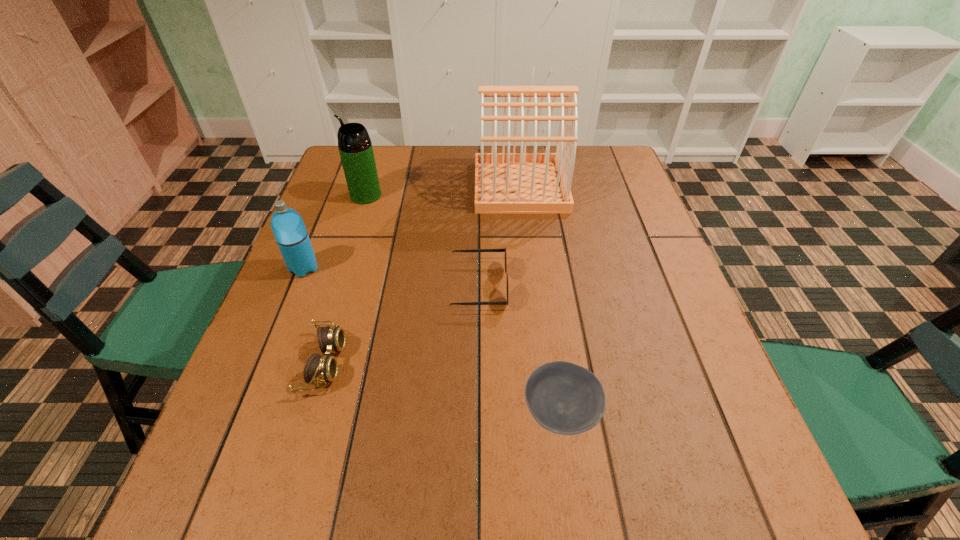
Find the location of a particular element. The height and width of the screenshot is (540, 960). free point that satisfies the following two spatial constraints: 1. from the spout of the second tallest object; 2. on the right side of the bowl is located at coordinates (297, 412).

This screenshot has height=540, width=960. I want to click on vacant space that satisfies the following two spatial constraints: 1. with an open door on the tallest object; 2. on the front side of the left thermos bottle, so click(530, 268).

The height and width of the screenshot is (540, 960). Identify the location of vacant position in the image that satisfies the following two spatial constraints: 1. on the front side of the shorter thermos bottle; 2. on the left side of the bowl. (245, 412).

Locate an element on the screen. Image resolution: width=960 pixels, height=540 pixels. blank area in the image that satisfies the following two spatial constraints: 1. through the lenses of the goggles; 2. on the right side of the bowl is located at coordinates (310, 412).